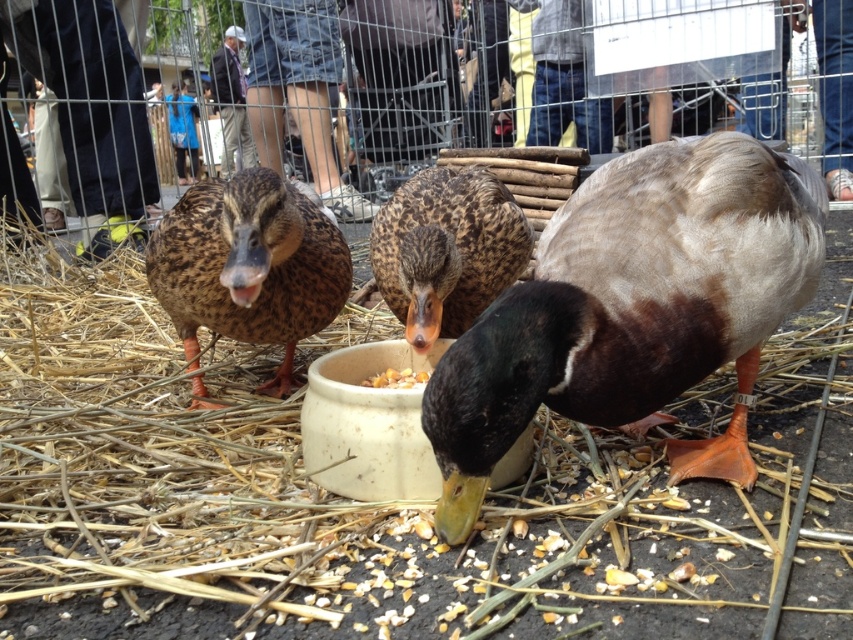
Which is behind, point (310, 262) or point (448, 259)?

Point (310, 262)

Measure the distance between brown speckled feathers at left and camera.

brown speckled feathers at left and camera are 1.25 meters apart from each other.

Is point (172, 282) positioned in front of point (518, 246)?

Yes, it is.

You are a GUI agent. You are given a task and a screenshot of the screen. Output one action in this format:
    pyautogui.click(x=<x>, y=<y>)
    Task: Click on the brown speckled feathers at left
    The image size is (853, 640).
    Given the screenshot: What is the action you would take?
    pyautogui.click(x=248, y=266)

Can you confirm if brown feathered duck at center is smaller than brown speckled feathers at left?

Incorrect, brown feathered duck at center is not smaller in size than brown speckled feathers at left.

I want to click on brown feathered duck at center, so click(633, 310).

Is brown speckled feathers at center behind yellow grain at center?

No, brown speckled feathers at center is in front of yellow grain at center.

Does brown speckled feathers at center appear on the right side of yellow grain at center?

Correct, you'll find brown speckled feathers at center to the right of yellow grain at center.

Describe the element at coordinates (445, 250) in the screenshot. This screenshot has height=640, width=853. I see `brown speckled feathers at center` at that location.

Find the location of a particular element. This screenshot has height=640, width=853. brown speckled feathers at center is located at coordinates (445, 250).